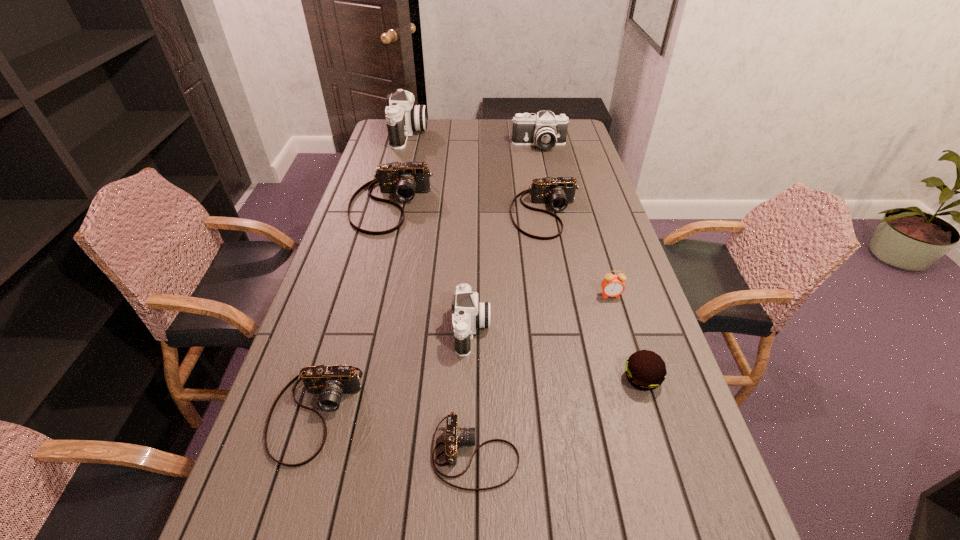
Locate an element on the screen. free location located on the front-facing side of the second biggest brown camera is located at coordinates (564, 310).

Where is `vacant space located 0.250m on the back of the patty`? Image resolution: width=960 pixels, height=540 pixels. vacant space located 0.250m on the back of the patty is located at coordinates (614, 291).

Locate an element on the screen. free region located on the front-facing side of the second brown camera from right to left is located at coordinates (615, 454).

Identify the location of alarm clock located at the right edge. (612, 285).

Find the location of `patty present at the right edge`. patty present at the right edge is located at coordinates (645, 370).

Locate an element on the screen. Image resolution: width=960 pixels, height=540 pixels. object situated at the far left corner is located at coordinates (402, 117).

The height and width of the screenshot is (540, 960). Identify the location of object that is at the far right corner. (545, 130).

Image resolution: width=960 pixels, height=540 pixels. In the image, there is a desktop. Identify the location of free space at the left edge. point(342,233).

The image size is (960, 540). Find the location of `free space at the right edge of the desktop`. free space at the right edge of the desktop is located at coordinates (650, 337).

This screenshot has width=960, height=540. What are the coordinates of `free space at the far right corner of the desktop` in the screenshot? It's located at (575, 131).